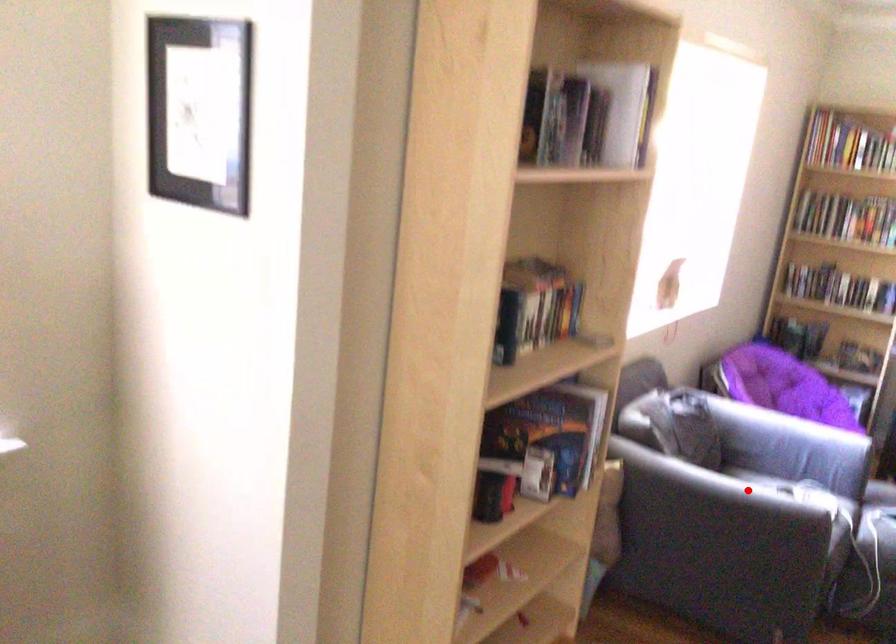
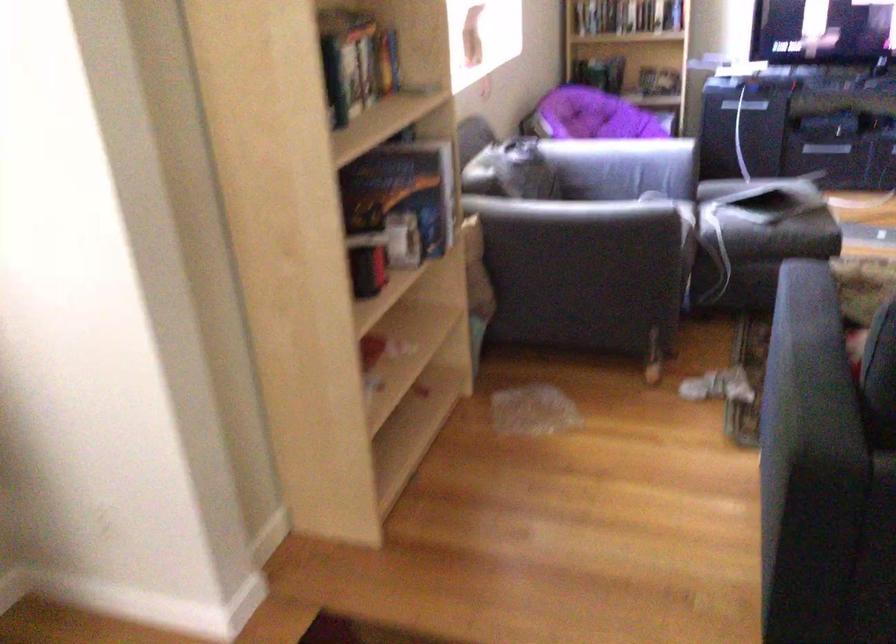
Where in the second image is the point corresponding to the highlighted location from the first image?

(597, 212)